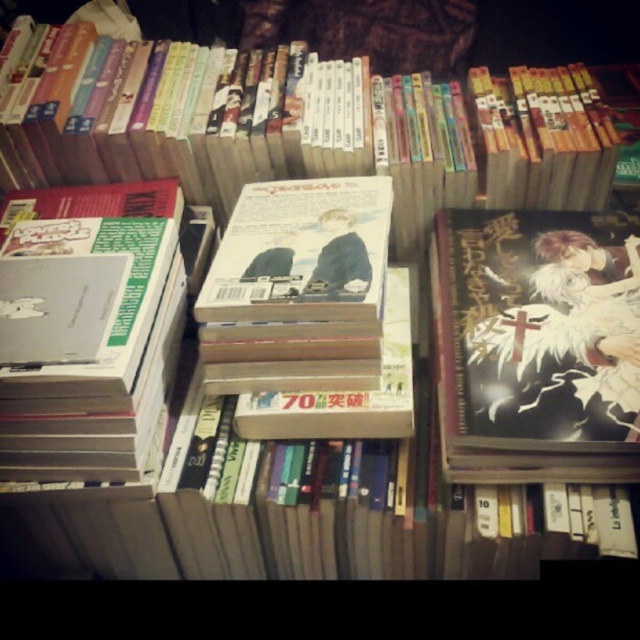
You are organizing the books on the wooden surface and notice two books at the center. Which one is closer to you, the black matte manga at center or the matte paperback book at center?

The black matte manga at center is closer to you because it is in front of the matte paperback book at center.

You are organizing a bookshelf and need to place both the black matte manga at center and the matte paperback book at center. If you want to arrange them vertically in order of their height from tallest to shortest, which book should be placed first?

The black matte manga at center is taller than the matte paperback book at center, so it should be placed first in the vertical arrangement from tallest to shortest.

You are organizing a bookshelf and need to place the black matte manga at center and the matte paperback book at center. Given their sizes, which one should you place first to ensure stability?

The black matte manga at center has a larger size compared to the matte paperback book at center, so you should place the black matte manga at center first to provide a stable base for the smaller matte paperback book at center.